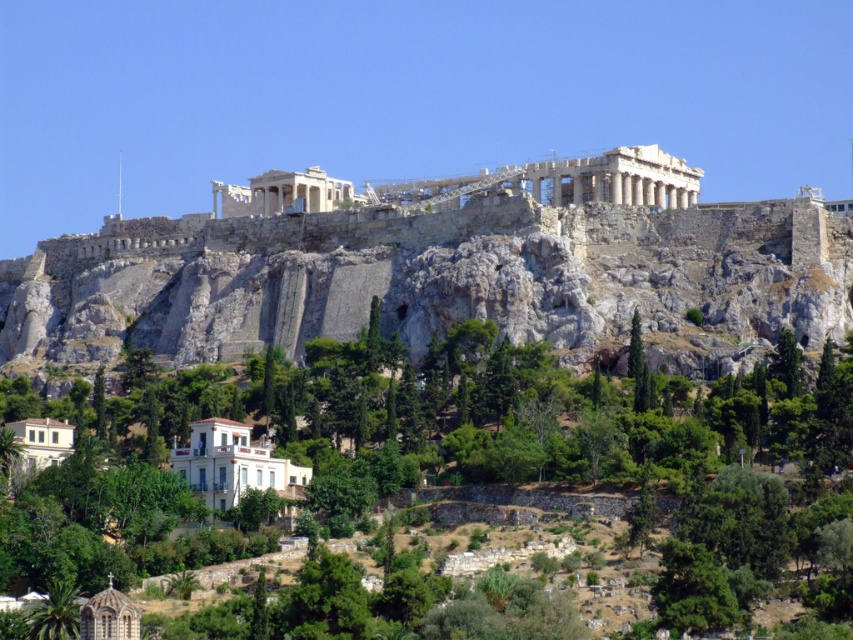
Consider the image. You are planning to plant a new tree in the Acropolis area. The new tree will grow to be as large as the green leafy tree at center. Considering the rugged stone mountain at center, will there be enough space for the new tree to grow to its full size without touching the mountain?

The rugged stone mountain at center is larger than the green leafy tree at center. Since the new tree will grow to be the same size as the existing green leafy tree at center, there should be sufficient space for it to grow without touching the mountain.

You are a tour guide leading a group to the Acropolis. You want to ensure everyone can walk comfortably between the rugged stone mountain at center and the green leafy tree at center. The widest participant in your group has a shoulder width of 1.2 meters. Is the path between these two landmarks wide enough for them to pass through comfortably?

The distance between the rugged stone mountain at center and the green leafy tree at center is 14.39 meters. Since the participant has a shoulder width of 1.2 meters, the path is more than wide enough for them to pass through comfortably.

You are standing at the base of the Acropolis and looking up at the rugged stone mountain at center and the green leafy tree at center. Which object is higher in your field of view?

The rugged stone mountain at center is above the green leafy tree at center, so it is higher in your field of view.